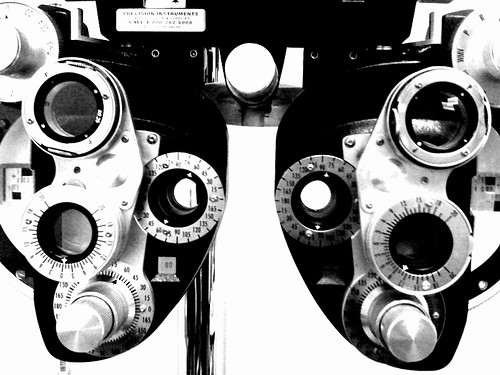
The width and height of the screenshot is (500, 375). I want to click on knob, so click(x=25, y=51), click(x=484, y=91).